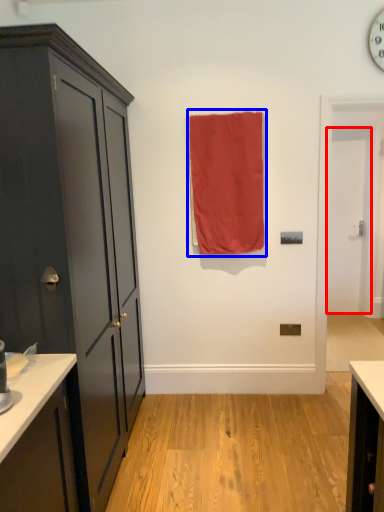
Question: Which point is closer to the camera, door (highlighted by a red box) or curtain (highlighted by a blue box)?

Choices:
 (A) door
 (B) curtain

Answer: (B)